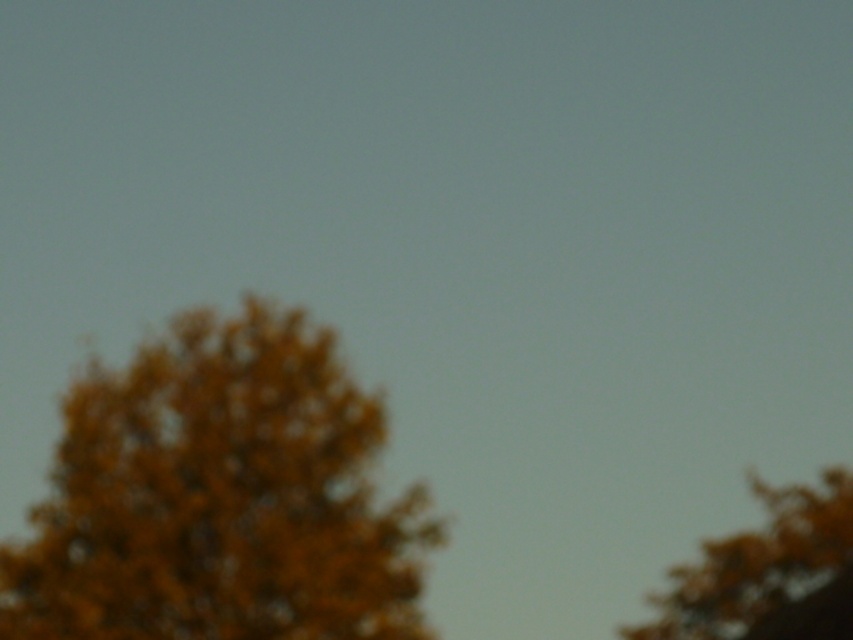
Between orange fuzzy tree at left and golden textured leaves at upper right, which one has less height?

golden textured leaves at upper right

Does orange fuzzy tree at left appear over golden textured leaves at upper right?

Indeed, orange fuzzy tree at left is positioned over golden textured leaves at upper right.

Which is behind, point (277, 381) or point (766, 545)?

Point (766, 545)

The image size is (853, 640). What are the coordinates of `orange fuzzy tree at left` in the screenshot? It's located at (219, 499).